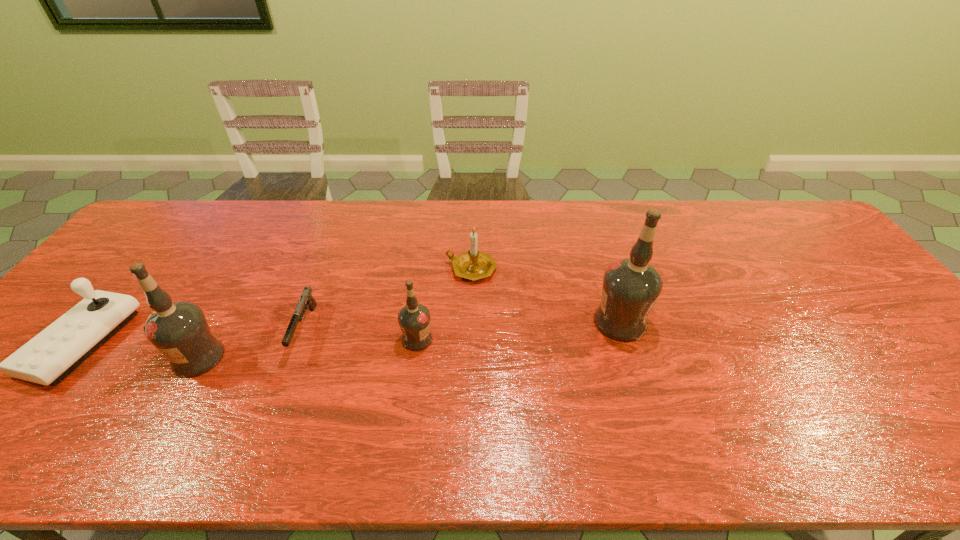
Where is `empty space between the farthest object and the rightmost vodka`? empty space between the farthest object and the rightmost vodka is located at coordinates [546, 295].

Where is `free space between the second vodka from right to left and the leftmost vodka`? free space between the second vodka from right to left and the leftmost vodka is located at coordinates (308, 348).

You are a GUI agent. You are given a task and a screenshot of the screen. Output one action in this format:
    pyautogui.click(x=<x>, y=<y>)
    Task: Click on the unoccupied area between the fourth object from left to right and the second tallest object
    
    Given the screenshot: What is the action you would take?
    pyautogui.click(x=308, y=348)

Where is `free space between the second vodka from right to left and the second tallest object`? The width and height of the screenshot is (960, 540). free space between the second vodka from right to left and the second tallest object is located at coordinates (308, 348).

The image size is (960, 540). Find the location of `vacant space that's between the farthest object and the shortest object`. vacant space that's between the farthest object and the shortest object is located at coordinates (388, 299).

Locate an element on the screen. The height and width of the screenshot is (540, 960). free space between the second tallest vodka and the second object from right to left is located at coordinates (335, 313).

Find the location of `free point between the second tallest vodka and the farthest object`. free point between the second tallest vodka and the farthest object is located at coordinates (335, 313).

Locate an element on the screen. This screenshot has height=540, width=960. the third closest object to the candle holder is located at coordinates (306, 298).

Where is `the closest object to the second tallest object`? the closest object to the second tallest object is located at coordinates (51, 355).

Find the location of a particular element. This screenshot has width=960, height=540. vodka that is the closest one to the second vodka from right to left is located at coordinates (631, 286).